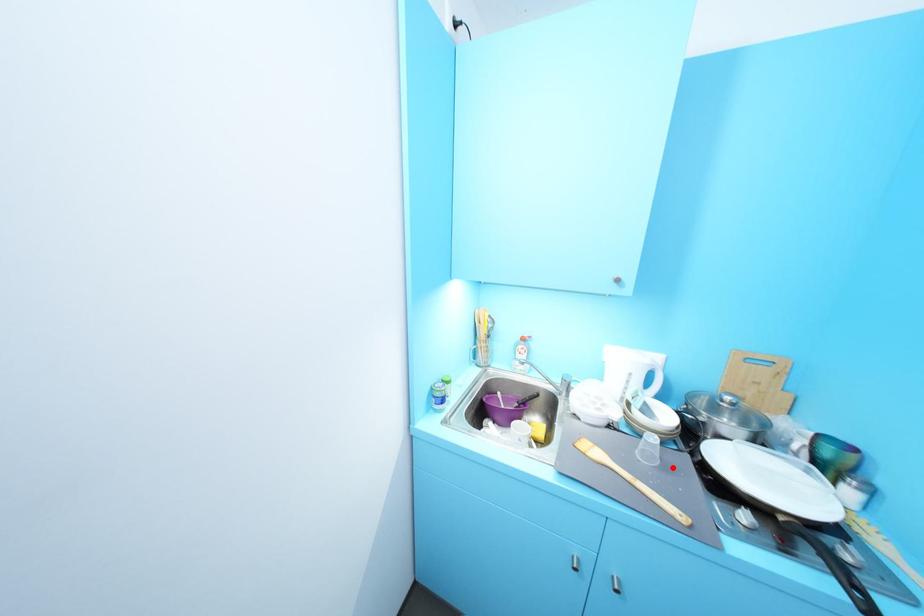
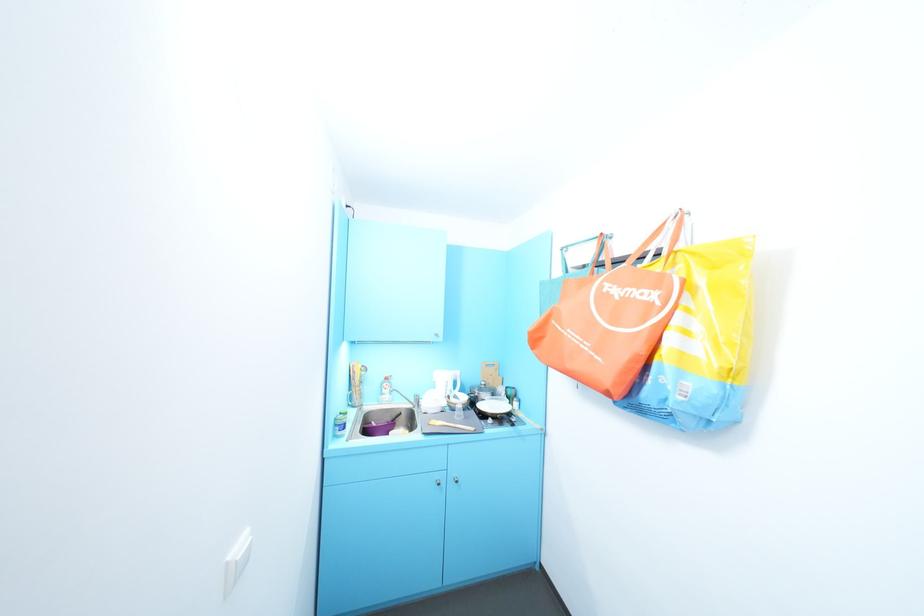
Question: I am providing you with two images of the same scene from different viewpoints. A red point is marked on the first image. At the location where the point appears in image 1, is it still visible in image 2?

Choices:
 (A) Yes
 (B) No

Answer: (A)